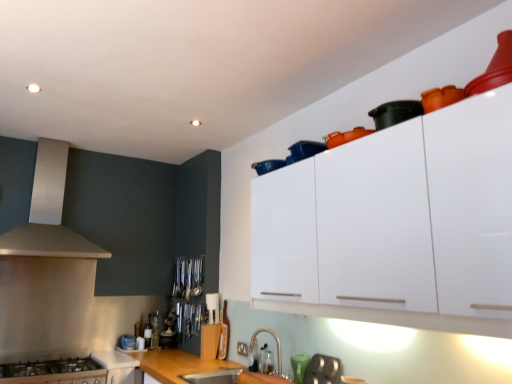
Question: Is orange matte pot at upper center, which is the 3th appliance in left-to-right order, in front of or behind teal glass at lower center in the image?

Choices:
 (A) front
 (B) behind

Answer: (A)

Question: From a real-world perspective, is orange matte pot at upper center, which is the 3th appliance in left-to-right order, above or below teal glass at lower center?

Choices:
 (A) below
 (B) above

Answer: (B)

Question: Which object is the farthest from the metallic silver utensils at center, arranged as the 2th appliance when ordered from the bottom?

Choices:
 (A) black plastic container at upper right, positioned as the first appliance in top-to-bottom order
 (B) teal glass at lower center
 (C) satin nickel faucet at lower center
 (D) wooden at lower center
 (E) orange matte pot at upper center, which is the 2th appliance in top-to-bottom order

Answer: (A)

Question: Estimate the real-world distances between objects in this image. Which object is farther from the metallic gray toaster at lower center, the fourth appliance in the top-to-bottom sequence?

Choices:
 (A) metallic silver utensils at center, which appears as the 3th appliance when viewed from the top
 (B) stainless steel stove at lower left, positioned as the 1th cabinetry in back-to-front order
 (C) satin silver range hood at left
 (D) orange matte pot at upper center, which is the 3th appliance from bottom to top
 (E) black plastic container at upper right, the fourth appliance positioned from the left

Answer: (C)